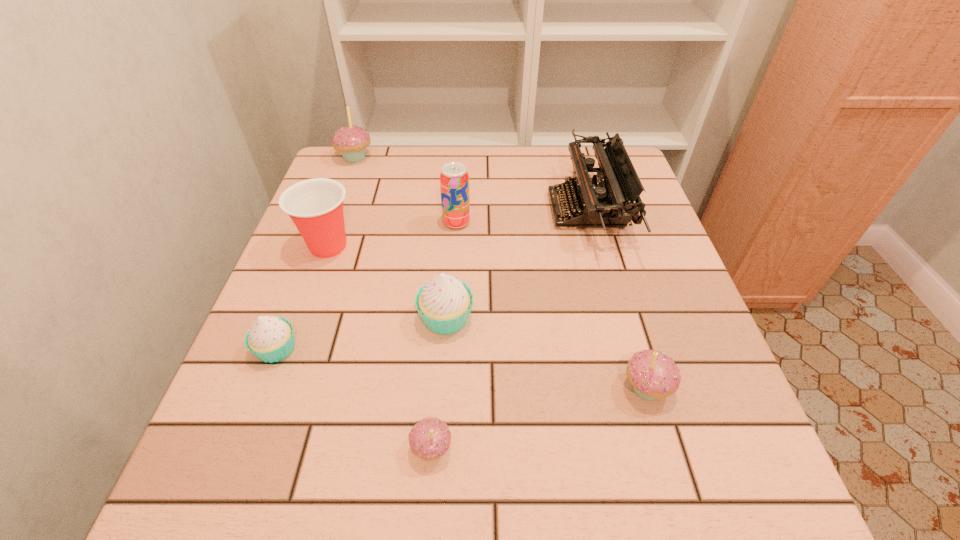
Where is `the farthest pink cupcake`? the farthest pink cupcake is located at coordinates (351, 141).

Locate an element on the screen. Image resolution: width=960 pixels, height=540 pixels. the leftmost pink cupcake is located at coordinates (351, 141).

You are a GUI agent. You are given a task and a screenshot of the screen. Output one action in this format:
    pyautogui.click(x=<x>, y=<y>)
    Task: Click on the soda can
    The width and height of the screenshot is (960, 540).
    Given the screenshot: What is the action you would take?
    pyautogui.click(x=454, y=179)

Find the location of a particular element. typewriter is located at coordinates (604, 203).

At what (x,y) coordinates should I click in order to perform the action: click on red cup. Please return your answer as a coordinate pair (x, y). Looking at the image, I should click on (315, 206).

I want to click on the right white cupcake, so click(x=444, y=303).

At what (x,y) coordinates should I click in order to perform the action: click on the rightmost pink cupcake. Please return your answer as a coordinate pair (x, y). Looking at the image, I should click on (652, 374).

Identify the location of the second smallest pink cupcake. (652, 374).

At what (x,y) coordinates should I click in order to perform the action: click on the left white cupcake. Please return your answer as a coordinate pair (x, y). This screenshot has width=960, height=540. Looking at the image, I should click on (270, 338).

This screenshot has width=960, height=540. What are the coordinates of `the nearest object` in the screenshot? It's located at (430, 438).